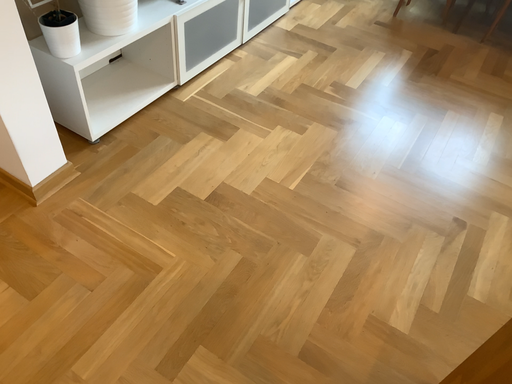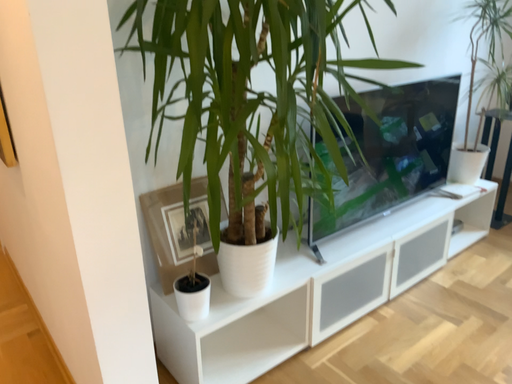
Question: Which way did the camera rotate in the video?

Choices:
 (A) rotated left
 (B) rotated right

Answer: (A)